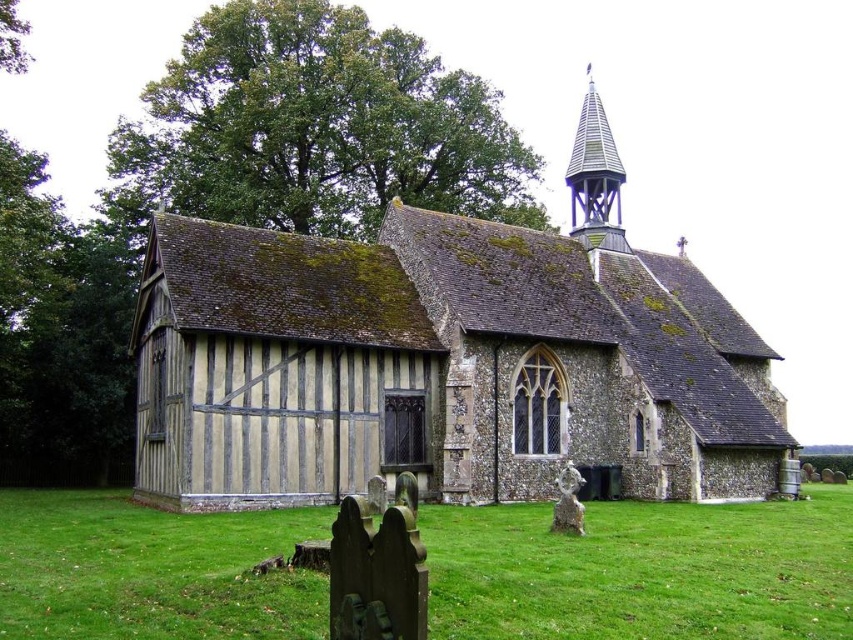
Question: Which of the following is the farthest from the observer?

Choices:
 (A) (839, 634)
 (B) (595, 186)
 (C) (397, 236)

Answer: (B)

Question: Which point is closer to the camera taking this photo?

Choices:
 (A) (289, 493)
 (B) (595, 509)
 (C) (595, 227)

Answer: (A)

Question: Among these objects, which one is farthest from the camera?

Choices:
 (A) shiny blue spire at upper right
 (B) green grass at lower center

Answer: (A)

Question: Where is wooden planks church at center located in relation to green grass at lower center in the image?

Choices:
 (A) right
 (B) left

Answer: (A)

Question: Is green grass at lower center further to camera compared to shiny blue spire at upper right?

Choices:
 (A) no
 (B) yes

Answer: (A)

Question: Can you confirm if green grass at lower center is positioned below shiny blue spire at upper right?

Choices:
 (A) yes
 (B) no

Answer: (A)